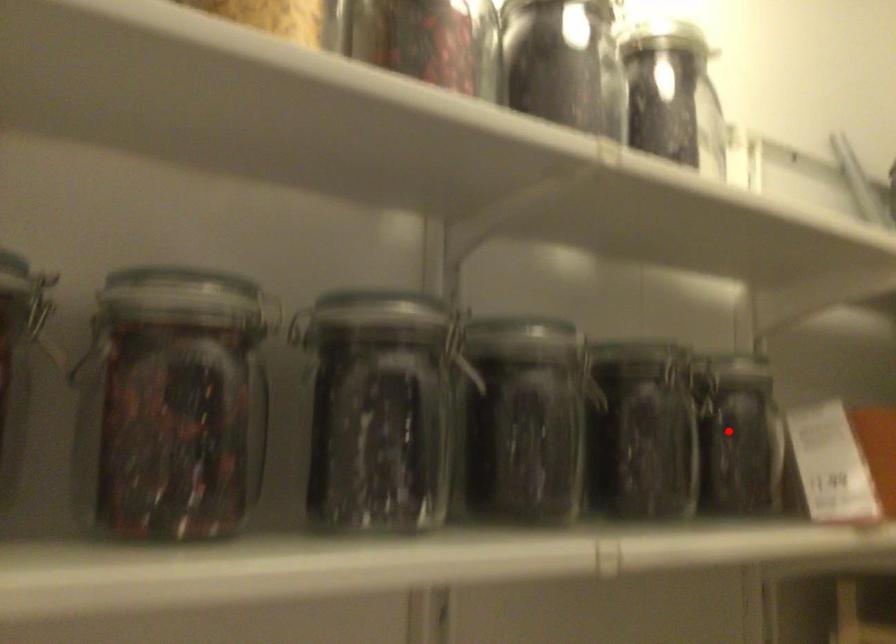
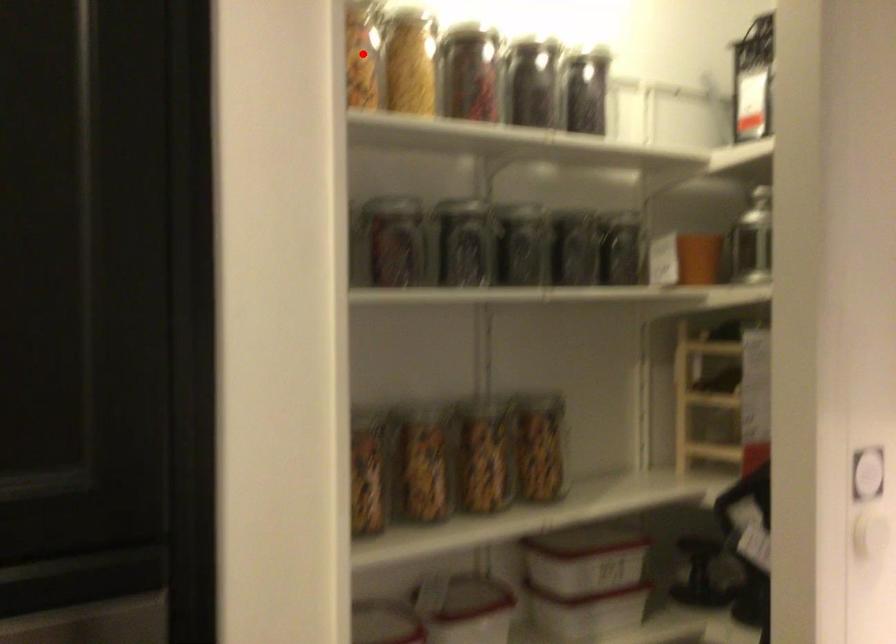
I am providing you with two images of the same scene from different viewpoints. A red point is marked on the first image and another point is marked on the second image. Are the points marked in image1 and image2 representing the same 3D position?

No